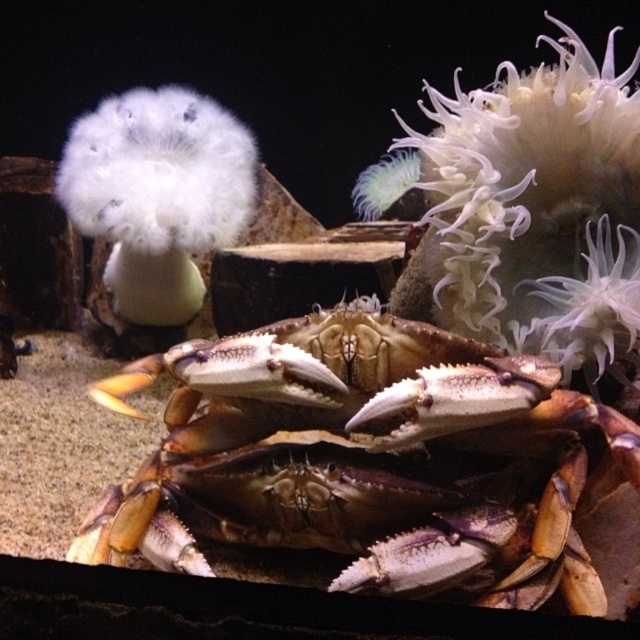
Based on the scene description, where is the brown hard shell crab at center located in terms of its 2D coordinates?

The brown hard shell crab at center is located at the 2D coordinates of point (x=371, y=460).

You are observing a crab in an aquarium. There are two points marked in the image, point A at coordinates point A is point (611,598) and point B at coordinates point B is point (140,230). Which point is closer to the crab?

Point A is closer to the crab because it is closer to the viewer than point B.